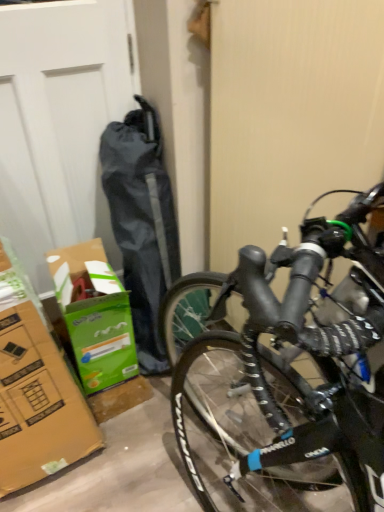
Question: Is white matte garage door at left situated inside black matte bicycle at right or outside?

Choices:
 (A) outside
 (B) inside

Answer: (A)

Question: In the image, is white matte garage door at left on the left side or the right side of black matte bicycle at right?

Choices:
 (A) left
 (B) right

Answer: (A)

Question: Which object is positioned closest to the black matte bicycle at right?

Choices:
 (A) white matte garage door at left
 (B) green cardboard box at lower left

Answer: (A)

Question: Estimate the real-world distances between objects in this image. Which object is farther from the black matte bicycle at right?

Choices:
 (A) white matte garage door at left
 (B) green cardboard box at lower left

Answer: (B)